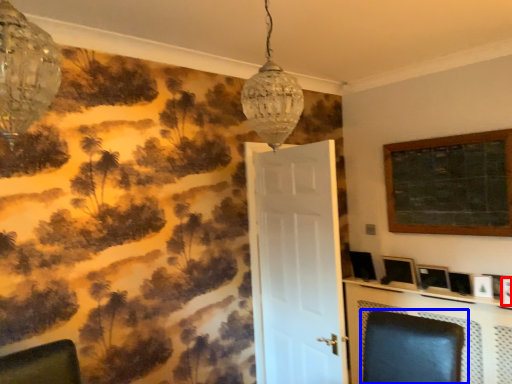
Question: Which object is closer to the camera taking this photo, picture frame (highlighted by a red box) or swivel chair (highlighted by a blue box)?

Choices:
 (A) picture frame
 (B) swivel chair

Answer: (B)